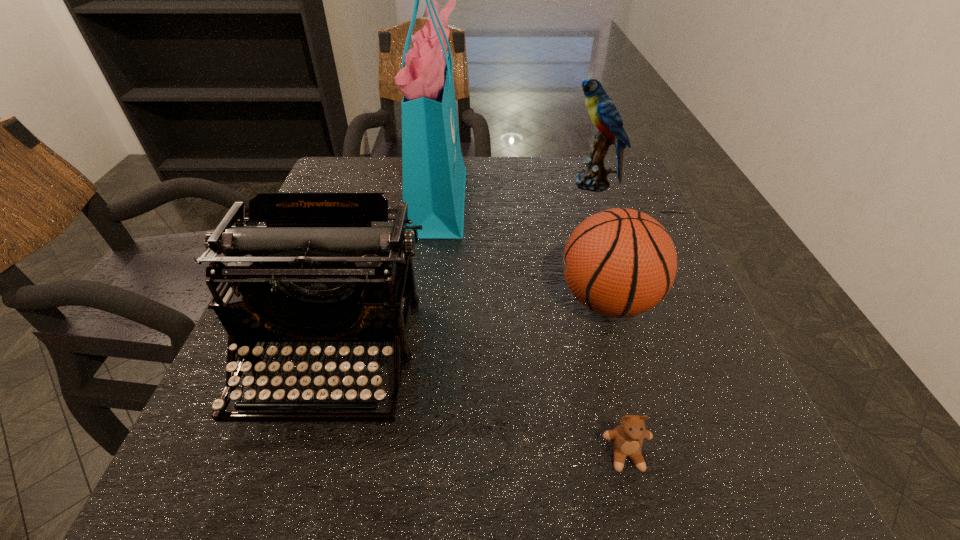
Find the location of a particular element. object at the far right corner is located at coordinates (604, 115).

In order to click on free region at the far edge in this screenshot , I will do `click(553, 191)`.

The width and height of the screenshot is (960, 540). What are the coordinates of `vacant space at the near edge of the desktop` in the screenshot? It's located at (398, 465).

Identify the location of vacant area at the right edge. The width and height of the screenshot is (960, 540). (680, 342).

The height and width of the screenshot is (540, 960). In the image, there is a desktop. What are the coordinates of `vacant space at the far left corner` in the screenshot? It's located at (365, 186).

Where is `free space at the near left corner of the desktop`? free space at the near left corner of the desktop is located at coordinates (178, 483).

Locate an element on the screen. Image resolution: width=960 pixels, height=540 pixels. vacant space in between the tallest object and the teddy bear is located at coordinates (532, 326).

At what (x,y) coordinates should I click in order to perform the action: click on free area in between the teddy bear and the parrot. Please return your answer as a coordinate pair (x, y). Looking at the image, I should click on (609, 319).

What are the coordinates of `free space between the parrot and the typewriter` in the screenshot? It's located at [x=463, y=271].

The image size is (960, 540). In order to click on free point between the teddy bear and the basketball in this screenshot , I will do `click(616, 378)`.